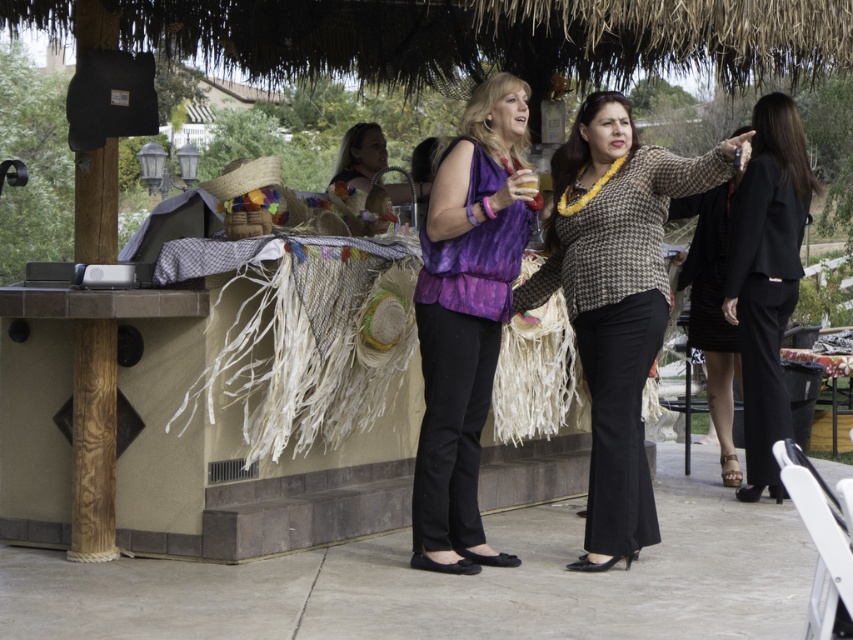
Does houndstooth fabric blouse at center come behind black matte suit at right?

No.

From the picture: Is houndstooth fabric blouse at center below black matte suit at right?

Yes.

Image resolution: width=853 pixels, height=640 pixels. I want to click on houndstooth fabric blouse at center, so click(x=614, y=298).

The image size is (853, 640). What do you see at coordinates (614, 298) in the screenshot?
I see `houndstooth fabric blouse at center` at bounding box center [614, 298].

Does houndstooth fabric blouse at center appear on the left side of purple silky blouse at center?

In fact, houndstooth fabric blouse at center is to the right of purple silky blouse at center.

I want to click on houndstooth fabric blouse at center, so click(614, 298).

In the scene shown: Can you confirm if purple silky blouse at center is taller than black matte suit at right?

No, purple silky blouse at center is not taller than black matte suit at right.

The image size is (853, 640). I want to click on purple silky blouse at center, so click(x=466, y=316).